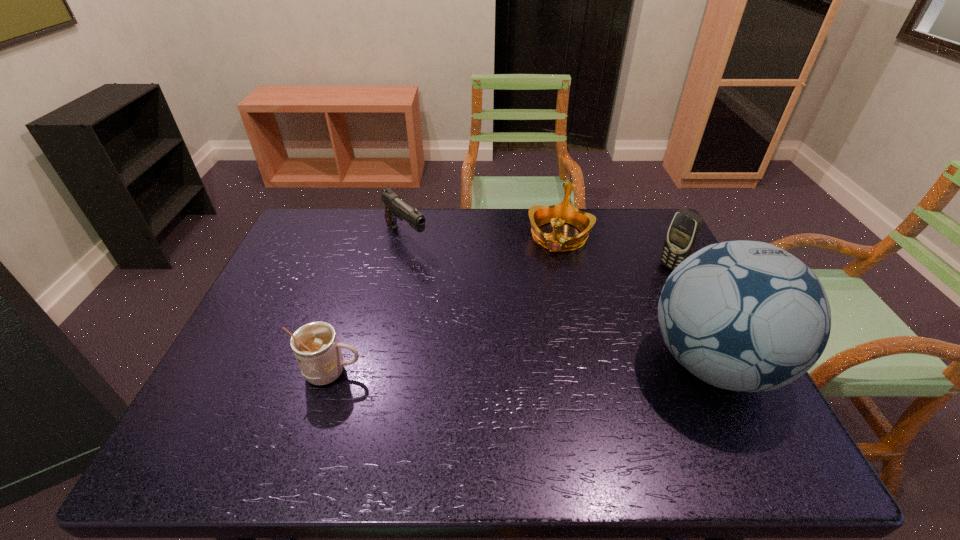
At what (x,y) coordinates should I click in order to perform the action: click on cellular telephone that is at the right edge. Please return your answer as a coordinate pair (x, y). This screenshot has height=540, width=960. Looking at the image, I should click on (683, 234).

Where is `object at the near right corner`? The height and width of the screenshot is (540, 960). object at the near right corner is located at coordinates (747, 316).

Find the location of a particular element. Image resolution: width=960 pixels, height=540 pixels. free space at the far edge of the desktop is located at coordinates (515, 245).

In the image, there is a desktop. Identify the location of vacant area at the near edge. The height and width of the screenshot is (540, 960). pyautogui.click(x=590, y=393).

Where is `blank area at the left edge`? This screenshot has width=960, height=540. blank area at the left edge is located at coordinates (307, 317).

Find the location of a particular element. Image resolution: width=960 pixels, height=540 pixels. vacant space at the right edge is located at coordinates [x=657, y=313].

Find the location of a particular element. The image size is (960, 540). vacant space at the far right corner of the desktop is located at coordinates (628, 249).

Where is `vacant region between the tiara and the tallest object`? vacant region between the tiara and the tallest object is located at coordinates (636, 300).

Locate an element on the screen. This screenshot has width=960, height=540. blank region between the second tallest object and the tiara is located at coordinates (615, 252).

I want to click on vacant space that is in between the cellular telephone and the cup, so click(x=502, y=320).